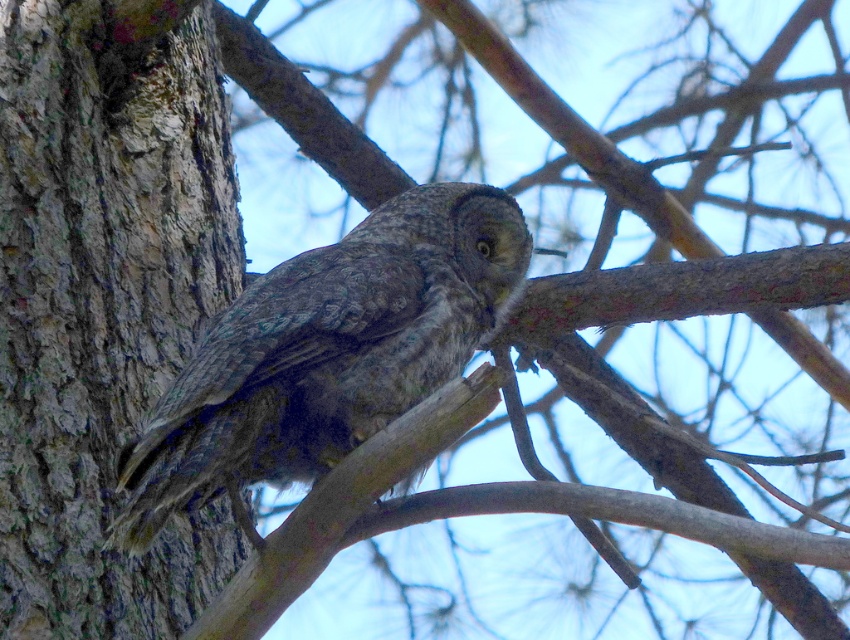
You are a birdwatcher trying to locate the rough bark tree trunk at left in the image. According to the coordinates provided, where exactly should you look on the image?

The rough bark tree trunk at left is located at coordinates point (103,314).

You are a birdwatcher trying to identify the speckled gray owl at center. You notice a rough bark tree trunk at left in the background. Which object is taller?

The rough bark tree trunk at left is much taller than the speckled gray owl at center.